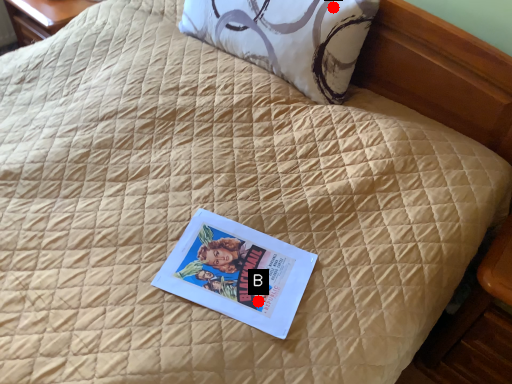
Question: Two points are circled on the image, labeled by A and B beside each circle. Which point is closer to the camera taking this photo?

Choices:
 (A) A is closer
 (B) B is closer

Answer: (B)